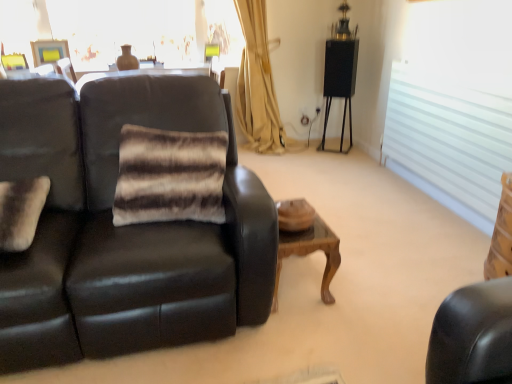
You are a GUI agent. You are given a task and a screenshot of the screen. Output one action in this format:
    pyautogui.click(x=<x>, y=<y>)
    Task: Click on the vacant space to the right of matte black couch at left
    This screenshot has width=512, height=384.
    Given the screenshot: What is the action you would take?
    pyautogui.click(x=356, y=284)